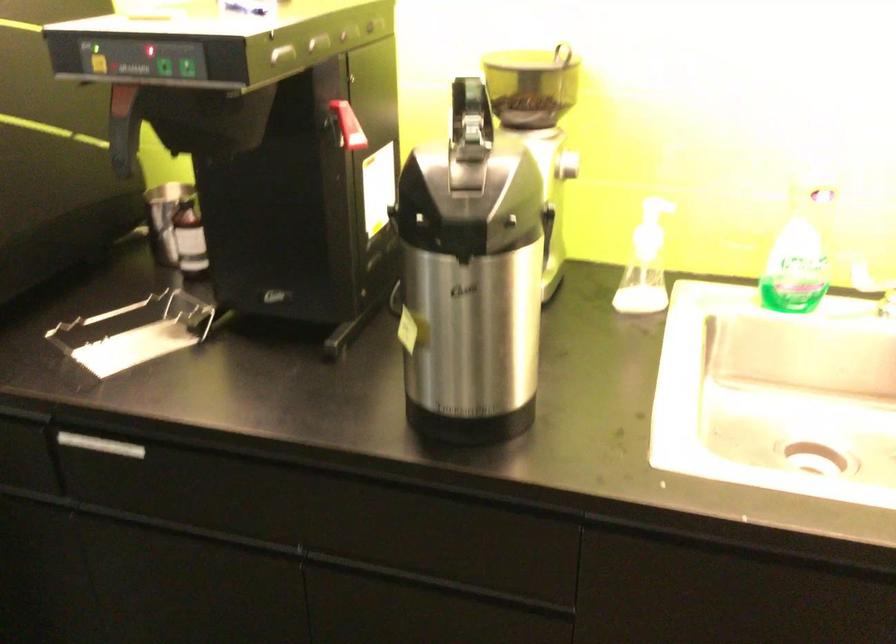
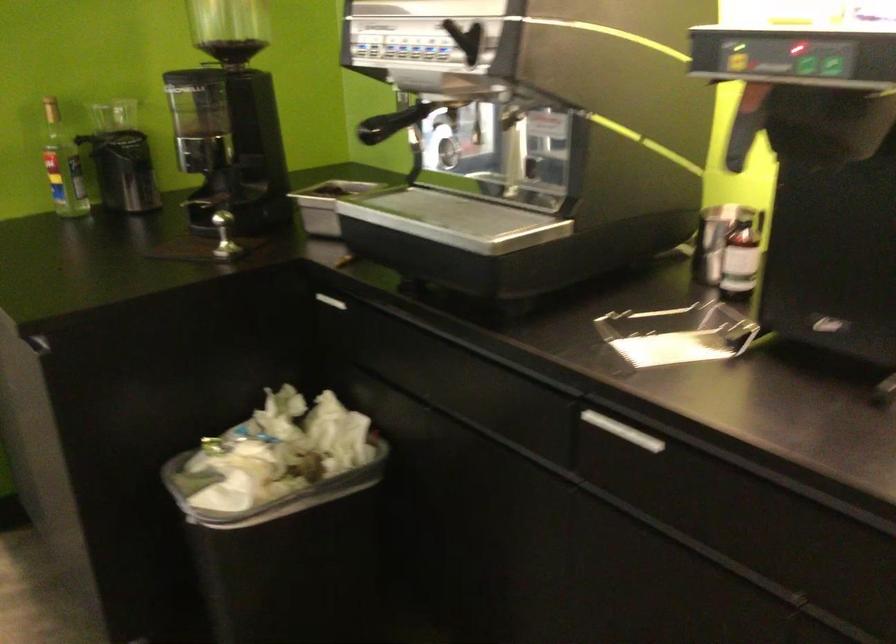
Question: The first image is from the beginning of the video and the second image is from the end. How did the camera likely rotate when shooting the video?

Choices:
 (A) Left
 (B) Right
 (C) Up
 (D) Down

Answer: (A)